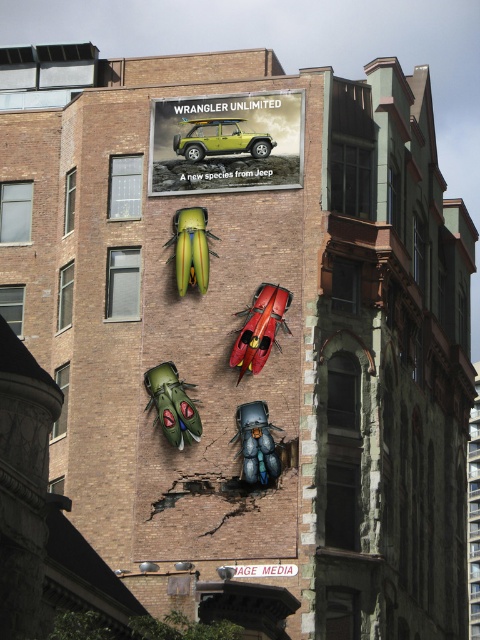
Is metallic red car at center bigger than matte green plastic car at upper center?

Yes, metallic red car at center is bigger than matte green plastic car at upper center.

Does metallic red car at center have a greater width compared to matte green plastic car at upper center?

No, metallic red car at center is not wider than matte green plastic car at upper center.

Measure the distance between metallic red car at center and camera.

The distance of metallic red car at center from camera is 61.58 meters.

This screenshot has height=640, width=480. In order to click on metallic red car at center in this screenshot , I will do `click(260, 328)`.

Is point (192, 173) positioned after point (256, 474)?

Yes, it is.

Can you confirm if matte green plastic jeep at upper center is shorter than blue metallic beetle at center?

Indeed, matte green plastic jeep at upper center has a lesser height compared to blue metallic beetle at center.

The width and height of the screenshot is (480, 640). I want to click on matte green plastic jeep at upper center, so click(x=227, y=141).

You are a GUI agent. You are given a task and a screenshot of the screen. Output one action in this format:
    pyautogui.click(x=<x>, y=<y>)
    Task: Click on the matte green plastic jeep at upper center
    
    Given the screenshot: What is the action you would take?
    pyautogui.click(x=227, y=141)

Does metallic red car at center have a lesser width compared to blue metallic beetle at center?

Incorrect, metallic red car at center's width is not less than blue metallic beetle at center's.

How distant is metallic red car at center from blue metallic beetle at center?

3.23 meters

Does point (257, 340) come in front of point (264, 436)?

No, (257, 340) is behind (264, 436).

Where is `metallic red car at center`? This screenshot has width=480, height=640. metallic red car at center is located at coordinates (260, 328).